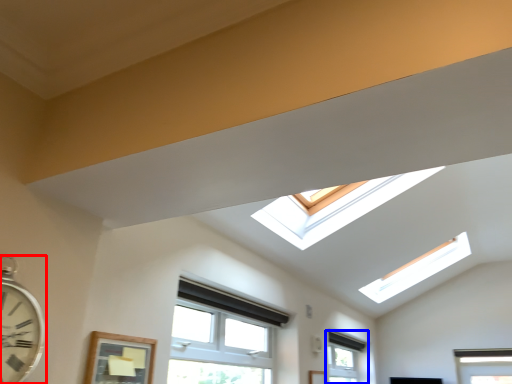
Question: Which object is further to the camera taking this photo, clock (highlighted by a red box) or window (highlighted by a blue box)?

Choices:
 (A) clock
 (B) window

Answer: (B)